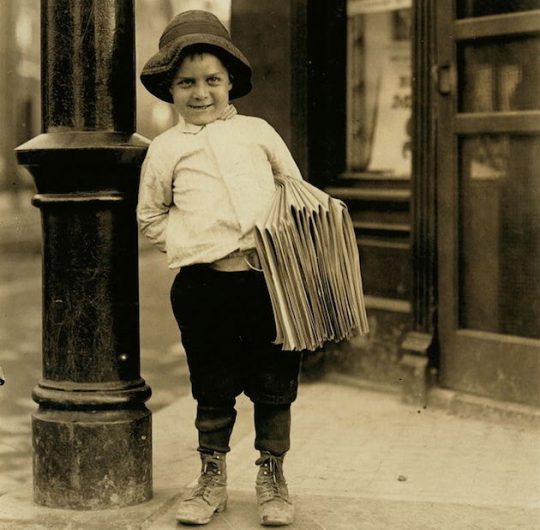
Identify the location of window. The height and width of the screenshot is (530, 540). (396, 130).